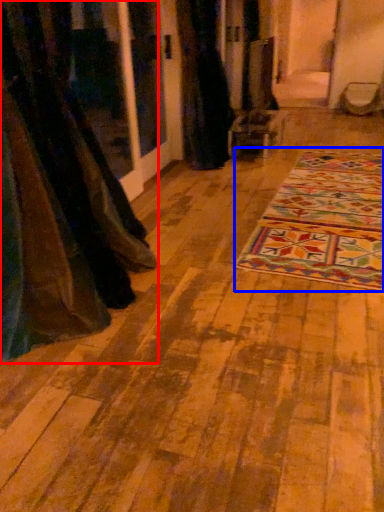
Question: Which of the following is the closest to the observer, curtain (highlighted by a red box) or mat (highlighted by a blue box)?

Choices:
 (A) curtain
 (B) mat

Answer: (A)